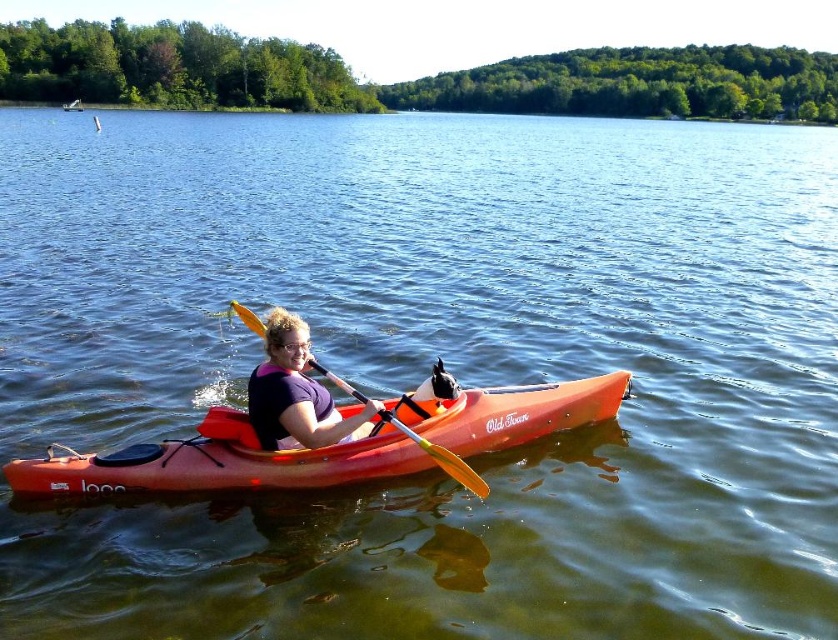
You are navigating a kayak and need to reach a destination marked by the point at coordinates point (236, 433). There is an obstacle at point point (261, 416). Based on the scene description, which point is closer to your current position in the kayak?

Point (261, 416) is closer to your current position because it is in front of point (236, 433), which is behind it.

You are a safety inspector evaluating the kayak setup. The orange matte kayak at center has a purple fabric life jacket at center. According to safety guidelines, life jackets must be worn and accessible. Is the current arrangement compliant with the requirement?

The orange matte kayak at center is much taller than the purple fabric life jacket at center, which means the life jacket might be stored below or behind the seat, making it inaccessible during emergencies. This arrangement does not comply with safety guidelines requiring life jackets to be worn or easily accessible.

You are a photographer planning to take a photo of the orange matte kayak at center and the matte purple shirt at center. Since you want to emphasize the size difference between them, which object should you focus on to highlight their relative sizes?

The orange matte kayak at center is larger than the matte purple shirt at center, so focusing on the orange matte kayak at center will emphasize its larger size compared to the matte purple shirt at center.